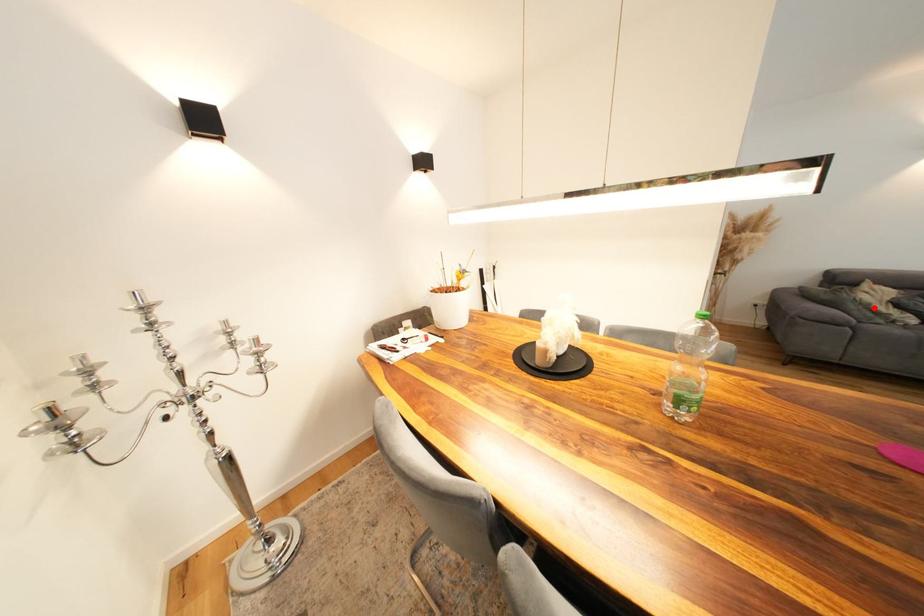
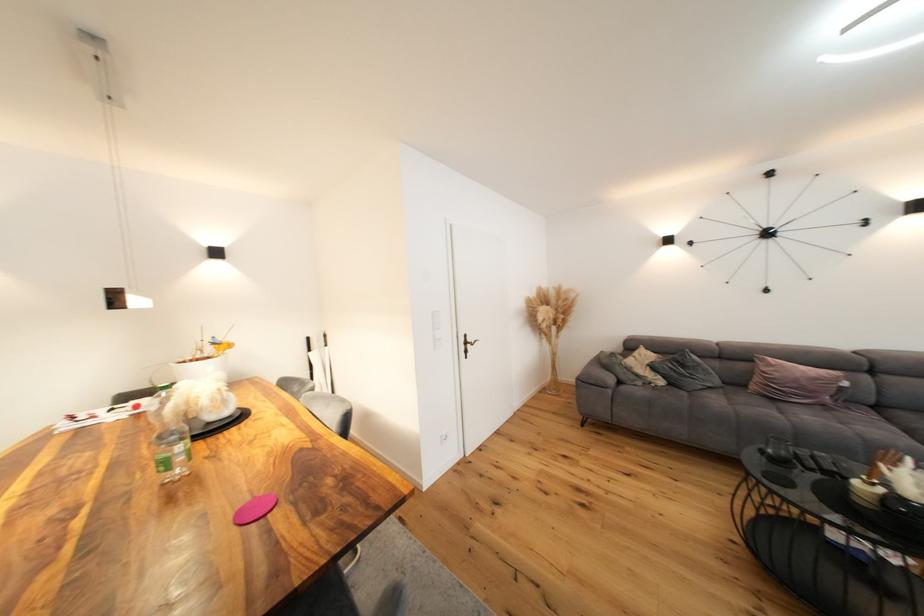
The point at the highlighted location is marked in the first image. Where is the corresponding point in the second image?

(637, 371)